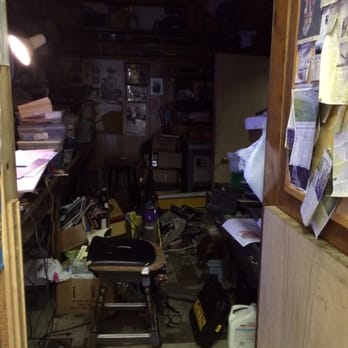
The image size is (348, 348). Identify the location of wall. (245, 91).